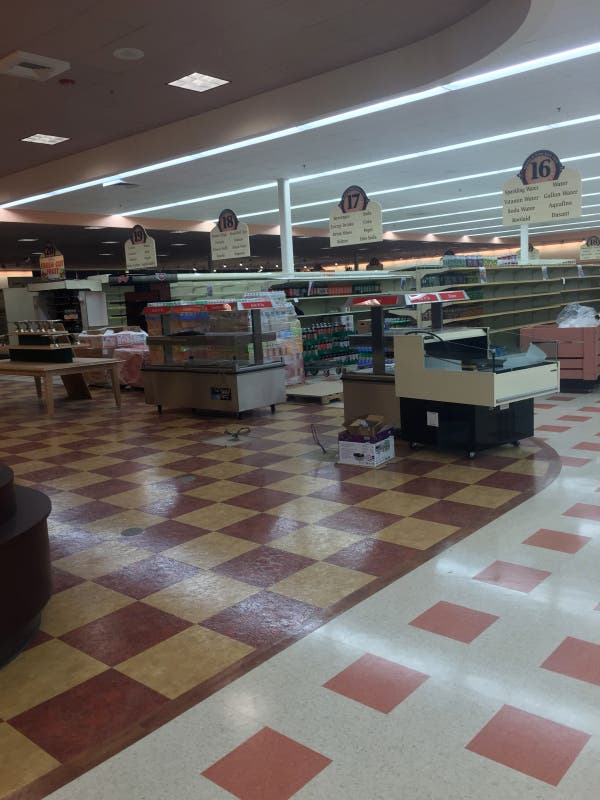
In order to click on yellow and red checkered floor in this screenshot , I will do `click(213, 592)`.